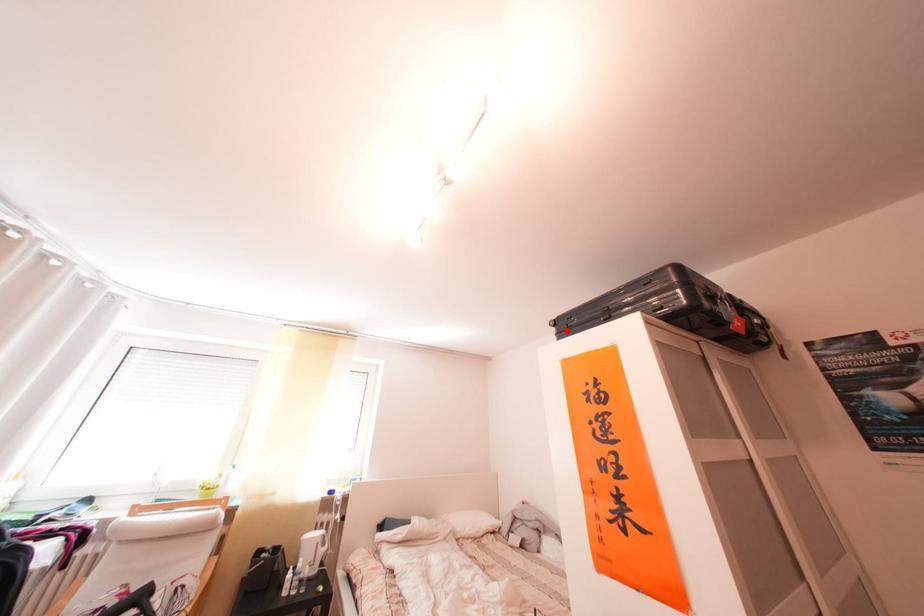
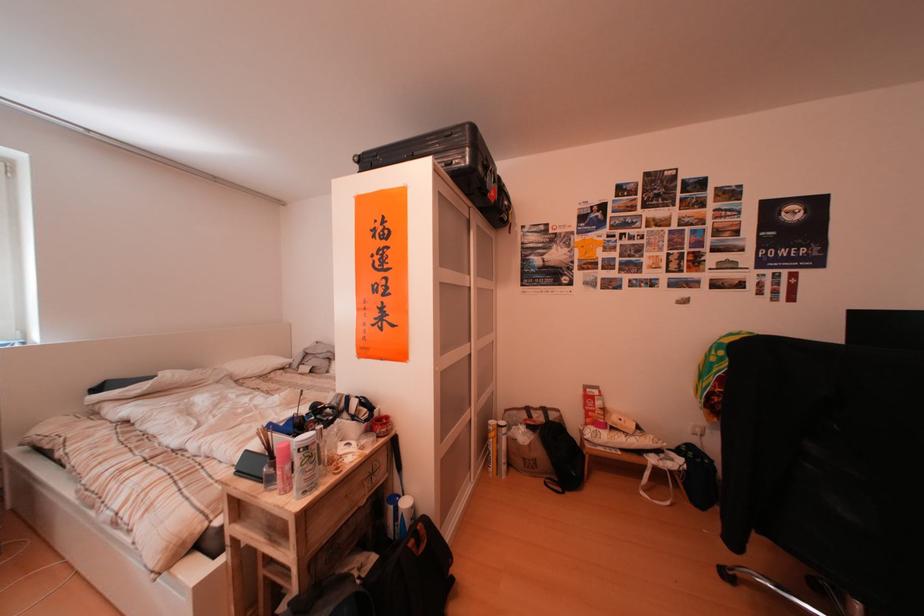
The point at the highlighted location is marked in the first image. Where is the corresponding point in the second image?

(371, 167)